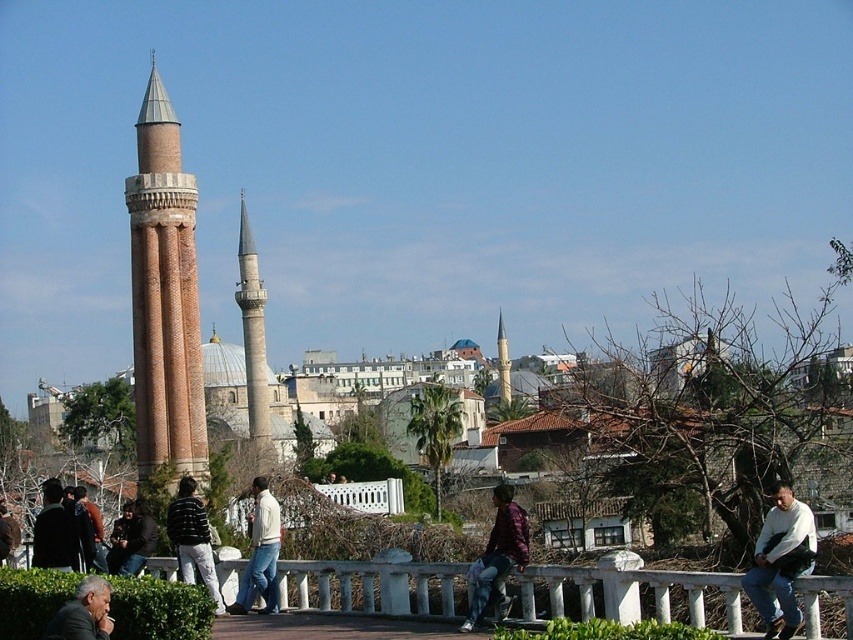
You are a photographer standing on the walkway and want to take a photo of the light beige sweater at center and the green leafy hedge at lower center. Which object will appear closer to the camera in the photo?

The light beige sweater at center will appear closer to the camera because the green leafy hedge at lower center is positioned behind it.

You are a tour guide leading a group along the walkway. You need to ensure that all visitors stay within a 20 meter radius of each other for safety. Given the distance between the maroon textured shirt at center and the dark gray suit at lower left, is this requirement being met?

The distance between the maroon textured shirt at center and the dark gray suit at lower left is 17.27 meters, which is within the 20 meter safety radius. Therefore, the requirement is currently being met.

You are standing at the point marked as point (498, 557) in the image. Looking around, you see a maroon textured shirt at center. What is the closest object to you?

The closest object to you is the maroon textured shirt at center located at point (498, 557).